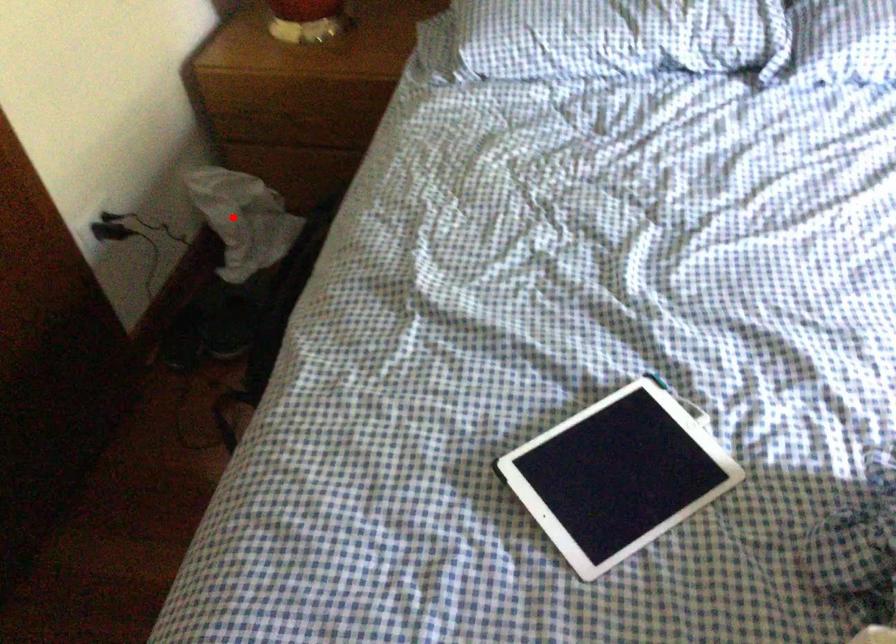
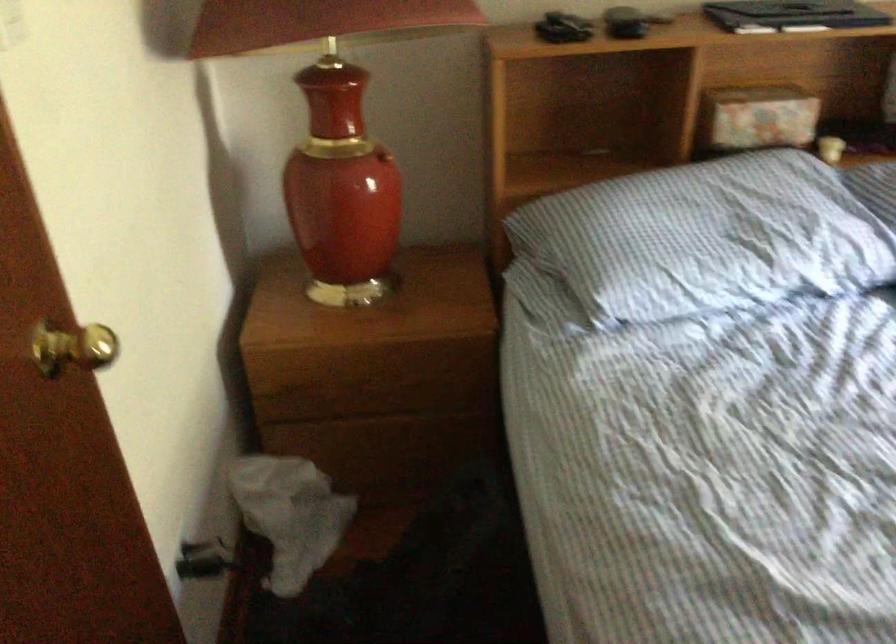
Question: I am providing you with two images of the same scene from different viewpoints. Image1 has a red point marked. In image2, the corresponding 3D location appears at what relative position? Reply with the corresponding letter.

Choices:
 (A) Closer
 (B) Farther

Answer: (A)